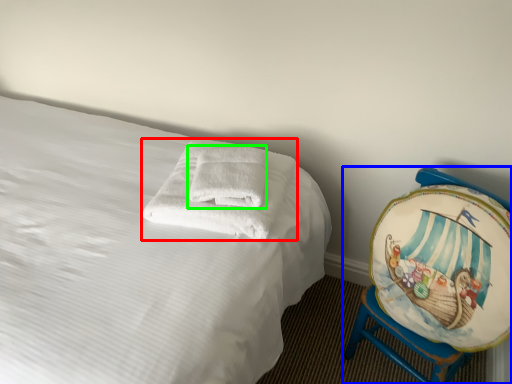
Question: Considering the real-world distances, which object is closest to towel (highlighted by a red box)? furniture (highlighted by a blue box) or bath towel (highlighted by a green box).

Choices:
 (A) furniture
 (B) bath towel

Answer: (B)